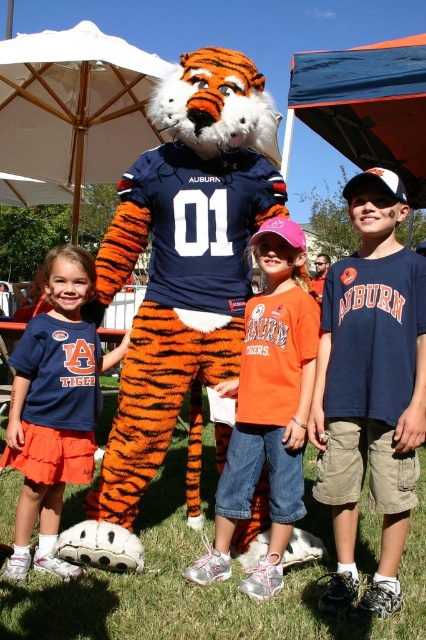
From the picture: You are a photographer trying to capture the orange tiger costume at center and the matte blue shirt at center in the same frame. Which object should you focus on first to ensure both are in focus?

The orange tiger costume at center is positioned over matte blue shirt at center, so you should focus on the orange tiger costume at center first to ensure both are in focus.

You are an event planner organizing a school event and need to decide which item to place on a 1.2 meter tall display stand. The orange tiger costume at center and the orange cotton shirt at center are both available. Which item would fit better on the stand based on their sizes?

The orange tiger costume at center has a greater height compared to the orange cotton shirt at center, so it would fit better on the 1.2 meter tall display stand since it is taller.

You are a photographer trying to capture a photo of the orange tiger costume at center and the blue cotton shirt at center. Based on their positions, which one is higher in the frame?

The orange tiger costume at center is located above the blue cotton shirt at center, so it is higher in the frame.